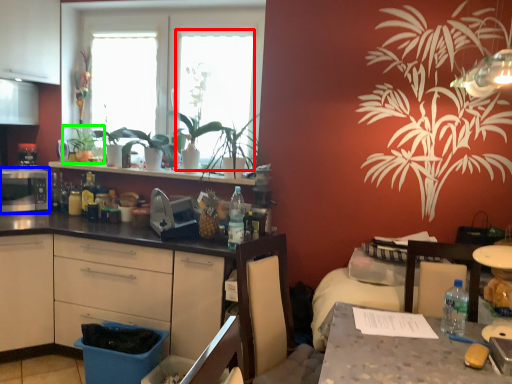
Question: Which is nearer to the window screen (highlighted by a red box)? appliance (highlighted by a blue box) or houseplant (highlighted by a green box).

Choices:
 (A) appliance
 (B) houseplant

Answer: (B)